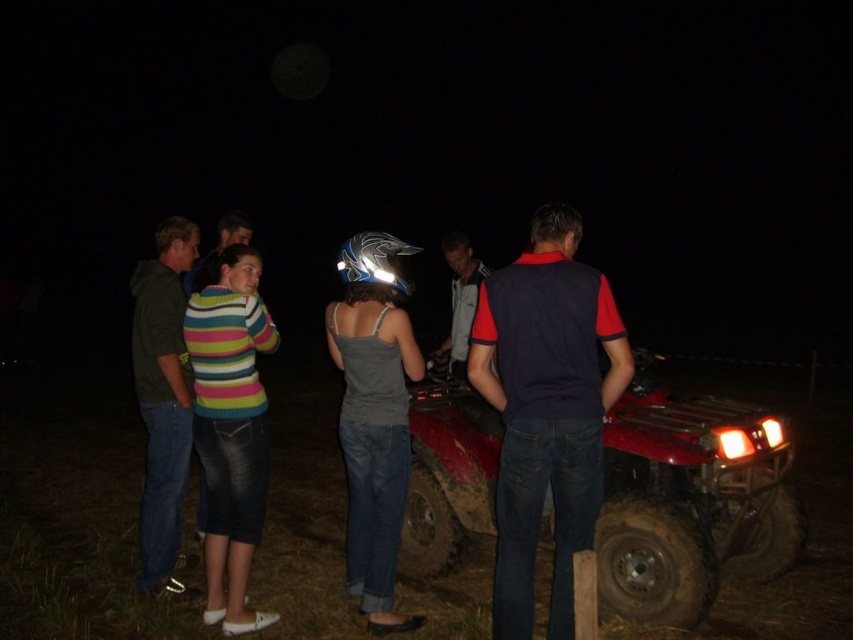
This screenshot has width=853, height=640. Describe the element at coordinates (230, 428) in the screenshot. I see `striped sweater at center` at that location.

Is striped sweater at center below dark green cotton shirt at left?

Yes, striped sweater at center is below dark green cotton shirt at left.

Which is behind, point (251, 429) or point (144, 564)?

Point (144, 564)

I want to click on striped sweater at center, so click(x=230, y=428).

Which is behind, point (525, 616) or point (142, 586)?

The point (142, 586) is behind.

Who is shorter, dark blue denim jeans at center or dark green cotton shirt at left?

Standing shorter between the two is dark blue denim jeans at center.

Find the location of a particular element. dark blue denim jeans at center is located at coordinates (546, 410).

From the picture: Does matte gray tank top at center have a lesser height compared to gray fleece jacket at center?

No.

Which is more to the left, matte gray tank top at center or gray fleece jacket at center?

matte gray tank top at center

From the picture: Who is more distant from viewer, (380,456) or (479,273)?

The point (479,273) is more distant.

The width and height of the screenshot is (853, 640). What are the coordinates of `matte gray tank top at center` in the screenshot? It's located at (373, 417).